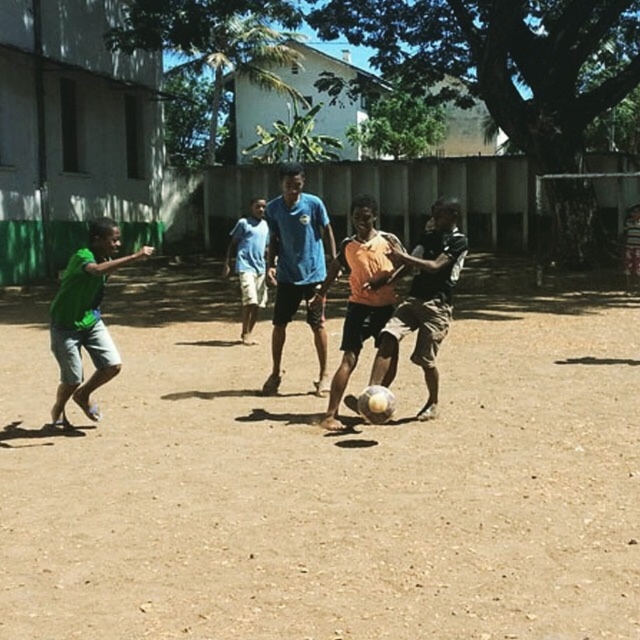
Question: Observing the image, what is the correct spatial positioning of brown sandy soil at center in reference to orange matte shirt at center?

Choices:
 (A) left
 (B) right

Answer: (A)

Question: Which of the following is the farthest from the observer?

Choices:
 (A) orange matte soccer ball at center
 (B) green matte shorts at left
 (C) orange matte shirt at center
 (D) blue fabric shirt at center

Answer: (D)

Question: Which point is closer to the camera?

Choices:
 (A) orange matte soccer ball at center
 (B) orange matte shirt at center
 (C) brown sandy soil at center

Answer: (C)

Question: Where is blue fabric shirt at center located in relation to orange matte soccer ball at center in the image?

Choices:
 (A) left
 (B) right

Answer: (A)

Question: Which object is farther from the camera taking this photo?

Choices:
 (A) orange matte shirt at center
 (B) brown sandy soil at center
 (C) blue cotton shirt at center
 (D) blue fabric shirt at center

Answer: (C)

Question: Does brown sandy soil at center come behind blue cotton shirt at center?

Choices:
 (A) yes
 (B) no

Answer: (B)